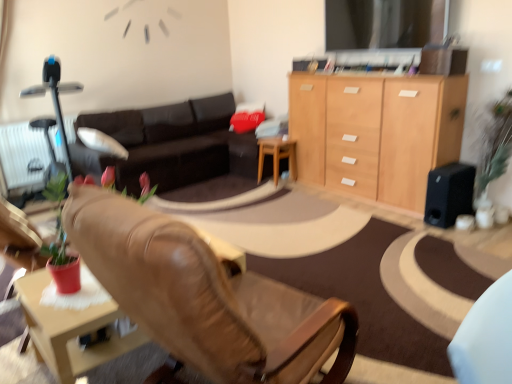
Question: Does leather chair at center appear on the right side of wooden at center?

Choices:
 (A) no
 (B) yes

Answer: (A)

Question: Does leather chair at center have a lesser height compared to wooden at center?

Choices:
 (A) yes
 (B) no

Answer: (B)

Question: Does leather chair at center have a lesser width compared to wooden at center?

Choices:
 (A) yes
 (B) no

Answer: (B)

Question: Is leather chair at center not near wooden at center?

Choices:
 (A) no
 (B) yes

Answer: (B)

Question: Is leather chair at center oriented towards wooden at center?

Choices:
 (A) no
 (B) yes

Answer: (A)

Question: Is leather chair at center positioned before wooden at center?

Choices:
 (A) no
 (B) yes

Answer: (B)

Question: From a real-world perspective, is white textured radiator at left over black matte speaker at right?

Choices:
 (A) no
 (B) yes

Answer: (B)

Question: From a real-world perspective, is white textured radiator at left under black matte speaker at right?

Choices:
 (A) no
 (B) yes

Answer: (A)

Question: Is white textured radiator at left surrounding black matte speaker at right?

Choices:
 (A) no
 (B) yes

Answer: (A)

Question: Is white textured radiator at left bigger than black matte speaker at right?

Choices:
 (A) yes
 (B) no

Answer: (A)

Question: Can you confirm if white textured radiator at left is thinner than black matte speaker at right?

Choices:
 (A) no
 (B) yes

Answer: (B)

Question: Is white textured radiator at left oriented towards black matte speaker at right?

Choices:
 (A) no
 (B) yes

Answer: (B)

Question: Is dark brown leather couch at center not near leather chair at center?

Choices:
 (A) yes
 (B) no

Answer: (A)